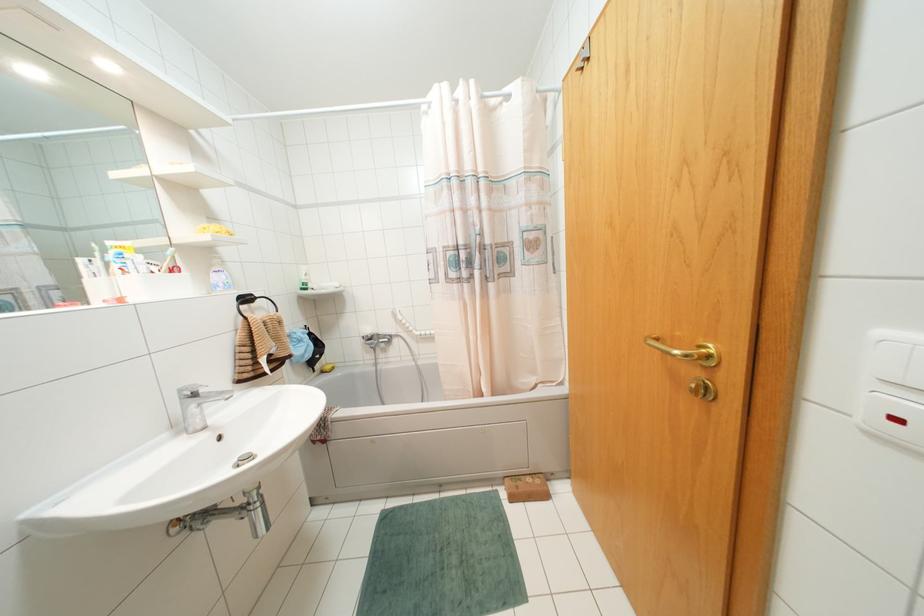
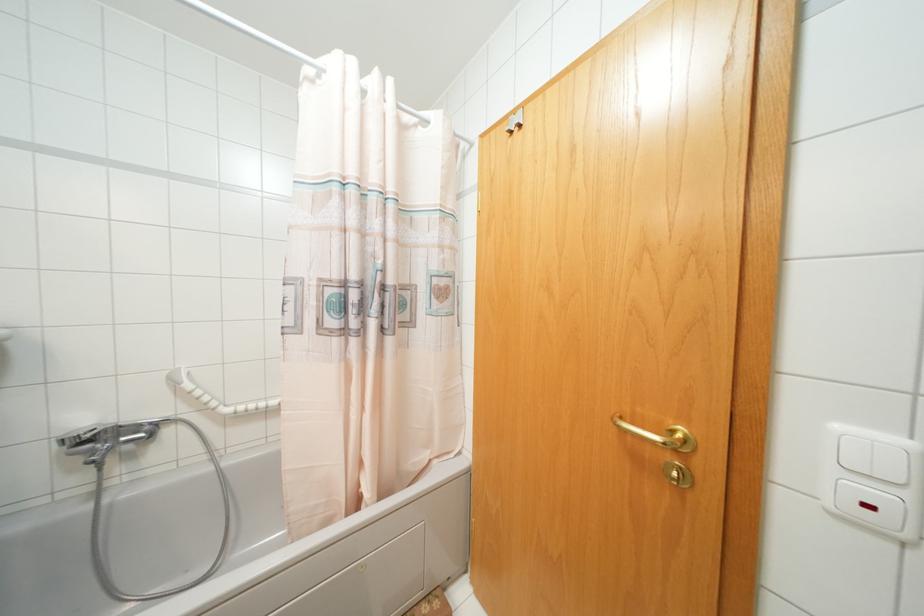
Question: The first image is from the beginning of the video and the second image is from the end. How did the camera likely rotate when shooting the video?

Choices:
 (A) Left
 (B) Right
 (C) Up
 (D) Down

Answer: (B)